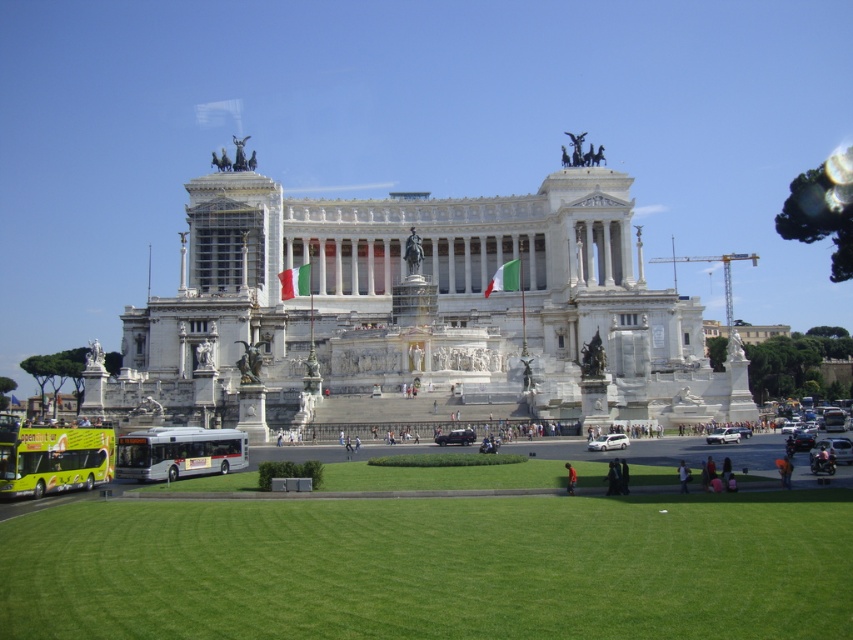
You are standing at the base of the monument looking towards the central plaza. There are two points marked on the lawn. Which point is closer to you, point (764, 557) or point (161, 476)?

Point (764, 557) is closer to you than point (161, 476).

You are a tourist standing at the monument entrance. You want to take a photo of the green grass at lower center and the silver metallic bus at lower left. Which object should you point your camera towards first if you want to capture both in one shot?

The green grass at lower center is below the silver metallic bus at lower left. To capture both in one shot, you should point your camera towards the silver metallic bus at lower left first since it is higher up, allowing the green grass at lower center to be included in the lower part of the frame.

You are a tourist standing on the lawn in front of the white marble palace at center and the silver metallic bus at lower left. Which object is closer to the left side of the image?

The silver metallic bus at lower left is closer to the left side of the image because the white marble palace at center is positioned on the right side of it.